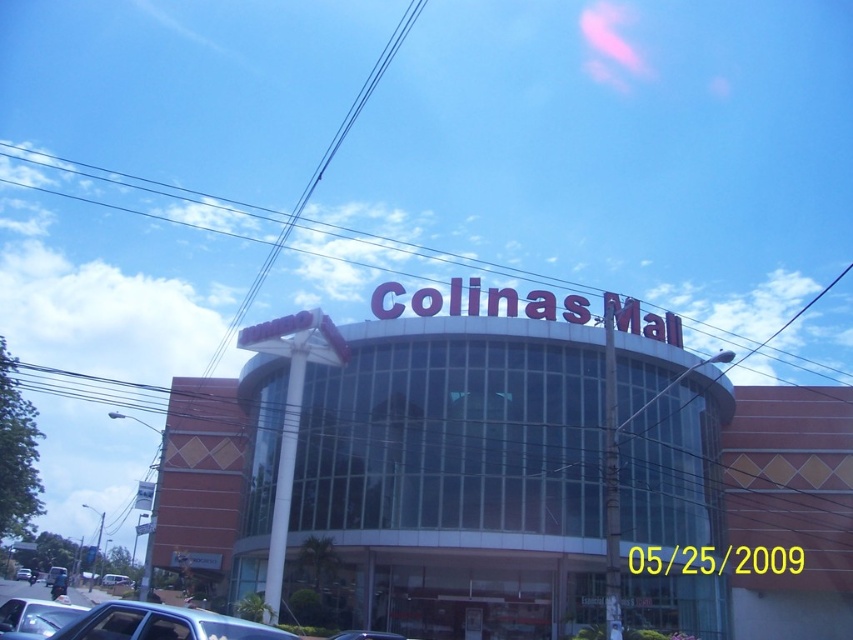
Is orange glass building at center positioned at the back of metallic blue sedan at lower left?

That is True.

Does point (828, 545) lie behind point (47, 637)?

Yes, point (828, 545) is behind point (47, 637).

Who is more forward, [270,445] or [202,636]?

Positioned in front is point [202,636].

Locate an element on the screen. The width and height of the screenshot is (853, 640). orange glass building at center is located at coordinates tap(512, 480).

Does orange glass building at center appear on the left side of metallic silver car at center?

In fact, orange glass building at center is to the right of metallic silver car at center.

Can you confirm if orange glass building at center is bigger than metallic silver car at center?

Yes, orange glass building at center is bigger than metallic silver car at center.

Measure the distance between orange glass building at center and camera.

They are 183.99 feet apart.

Image resolution: width=853 pixels, height=640 pixels. Identify the location of orange glass building at center. (512, 480).

Can you confirm if metallic silver car at lower left is positioned to the left of metallic silver car at center?

No, metallic silver car at lower left is not to the left of metallic silver car at center.

Can you confirm if metallic silver car at lower left is thinner than metallic silver car at center?

No.

Identify the location of metallic silver car at lower left. The height and width of the screenshot is (640, 853). (53, 573).